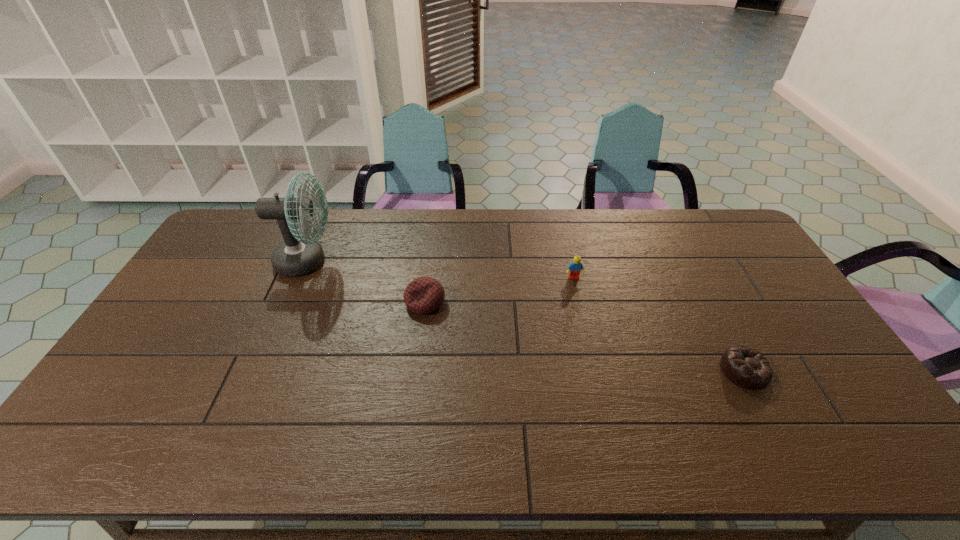
Image resolution: width=960 pixels, height=540 pixels. What are the coordinates of `blank area located 0.140m on the right of the third tallest object` in the screenshot? It's located at (491, 302).

You are a GUI agent. You are given a task and a screenshot of the screen. Output one action in this format:
    pyautogui.click(x=<x>, y=<y>)
    Task: Click on the vacant position located 0.290m on the back of the right beanbag
    The image size is (960, 540).
    Given the screenshot: What is the action you would take?
    pyautogui.click(x=696, y=280)

This screenshot has height=540, width=960. I want to click on object at the far edge, so click(x=295, y=256).

In the image, there is a desktop. Identify the location of vacant space at the far edge. (648, 213).

I want to click on free space at the near edge of the desktop, so (x=328, y=457).

In the image, there is a desktop. At what (x,y) coordinates should I click in order to perform the action: click on free region at the left edge. Please return your answer as a coordinate pair (x, y). The height and width of the screenshot is (540, 960). Looking at the image, I should click on (137, 352).

I want to click on free space at the right edge of the desktop, so click(777, 306).

The width and height of the screenshot is (960, 540). Find the location of `vacant region at the far left corner of the desktop`. vacant region at the far left corner of the desktop is located at coordinates (245, 222).

You are a GUI agent. You are given a task and a screenshot of the screen. Output one action in this format:
    pyautogui.click(x=<x>, y=<y>)
    Task: Click on the free region at the near left corner of the desktop
    
    Given the screenshot: What is the action you would take?
    pyautogui.click(x=139, y=444)

In the image, there is a desktop. Identify the location of vacant space at the far right corner. (723, 221).